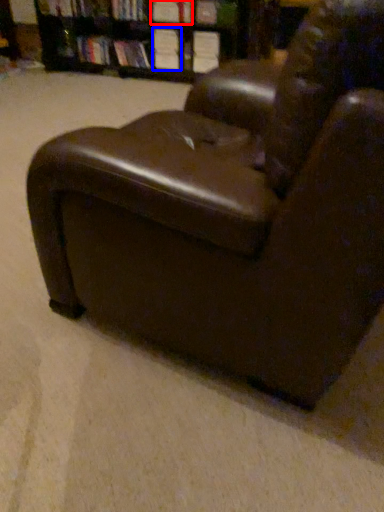
Question: Which of the following is the farthest to the observer, book (highlighted by a red box) or book (highlighted by a blue box)?

Choices:
 (A) book
 (B) book

Answer: (B)